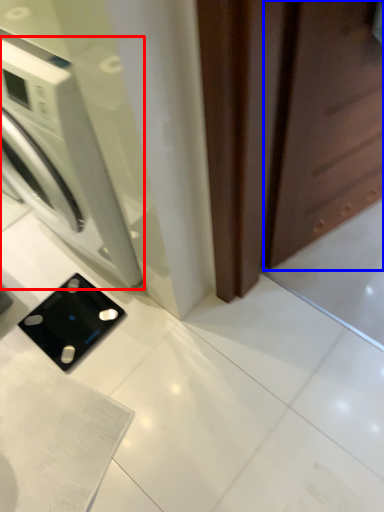
Question: Which object is further to the camera taking this photo, washing machine (highlighted by a red box) or screen door (highlighted by a blue box)?

Choices:
 (A) washing machine
 (B) screen door

Answer: (A)